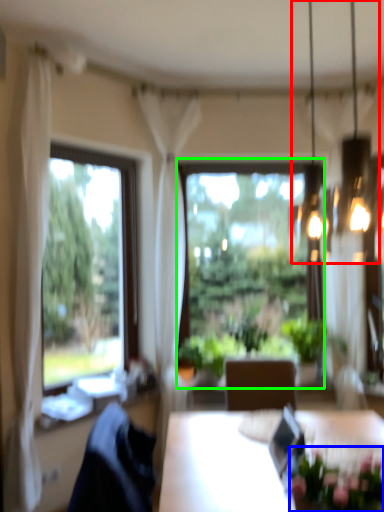
Question: Which object is positioned farthest from chandelier (highlighted by a red box)? Select from floral arrangement (highlighted by a blue box) and window (highlighted by a green box).

Choices:
 (A) floral arrangement
 (B) window

Answer: (A)